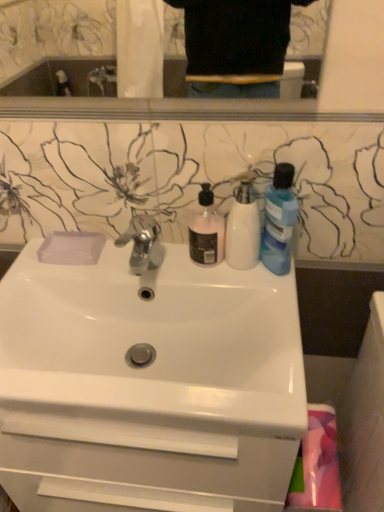
Find the location of a particular element. Image resolution: width=384 pixels, height=512 pixels. vacant space that is in between polished chrome faucet at center and pink matte liquid soap at center, which is the 3th cleaning product from right to left is located at coordinates (180, 265).